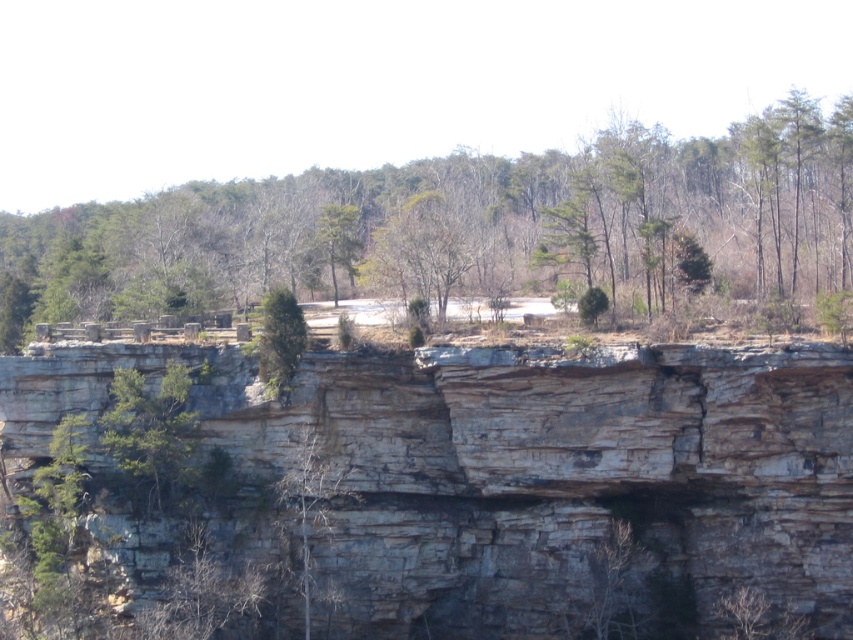
You are standing on the cliff platform and want to place a small bench between the green leafy tree at center and the green textured tree at center. Which tree should you position the bench closer to if you want it to be nearer to the left side of the platform?

You should position the bench closer to the green leafy tree at center because it is located to the left of the green textured tree at center, making it nearer to the left side of the platform.

You are a hiker standing at the base of the gray rock cliff at center and the green textured tree at center. Which object is positioned to the right when facing the cliff?

The gray rock cliff at center is to the right of the green textured tree at center, so when facing the cliff, the gray rock cliff at center is positioned to the right of the green textured tree at center.

You are standing at the base of the cliff and want to reach the point marked at coordinates (440, 273) on the cliff face. Given that the distance between you and this point is 216.02 feet, can you estimate how far you need to climb vertically to reach it?

The point at coordinates (440, 273) is 216.02 feet away from your current position. However, without knowing the angle or slope of the cliff, it is impossible to determine the exact vertical distance you need to climb.